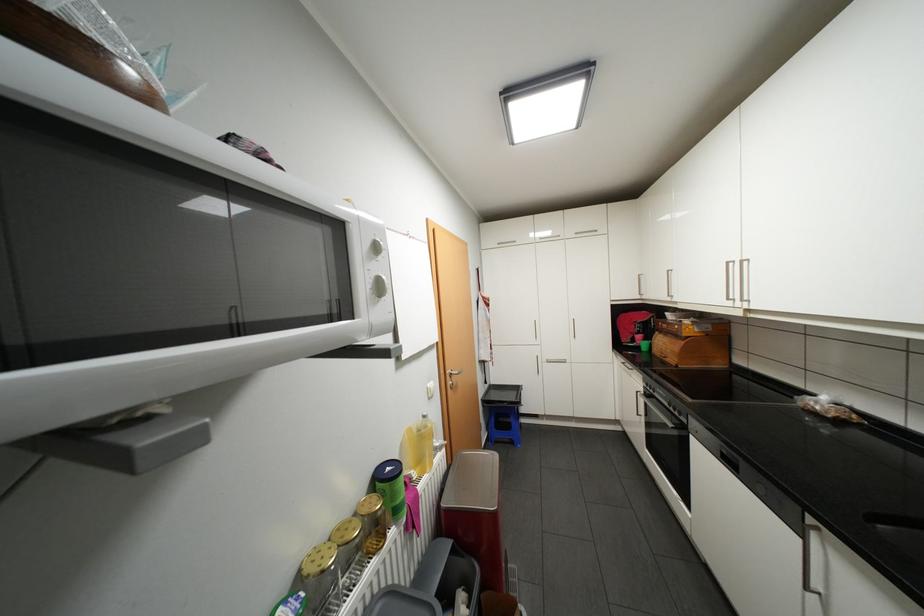
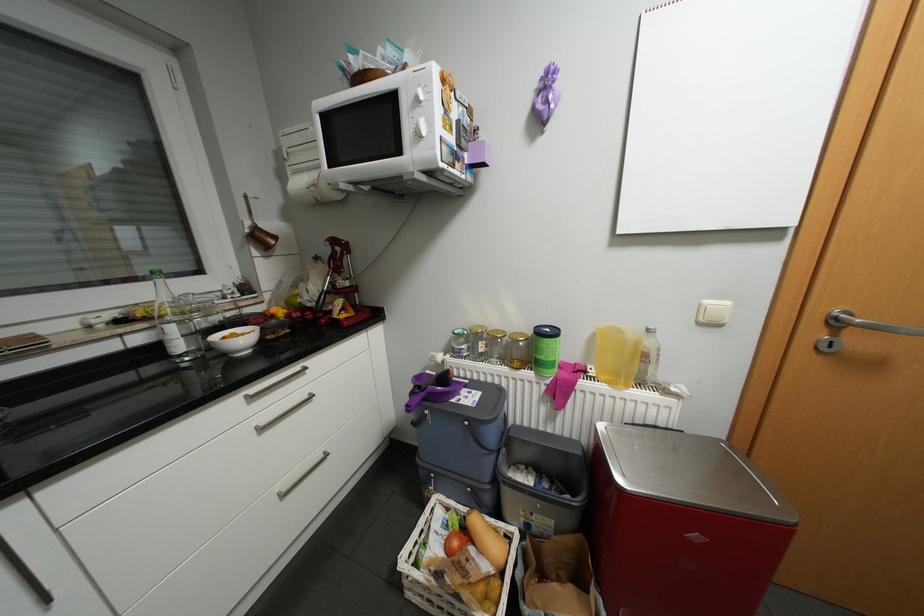
The point at (438, 398) is marked in the first image. Where is the corresponding point in the second image?

(708, 323)